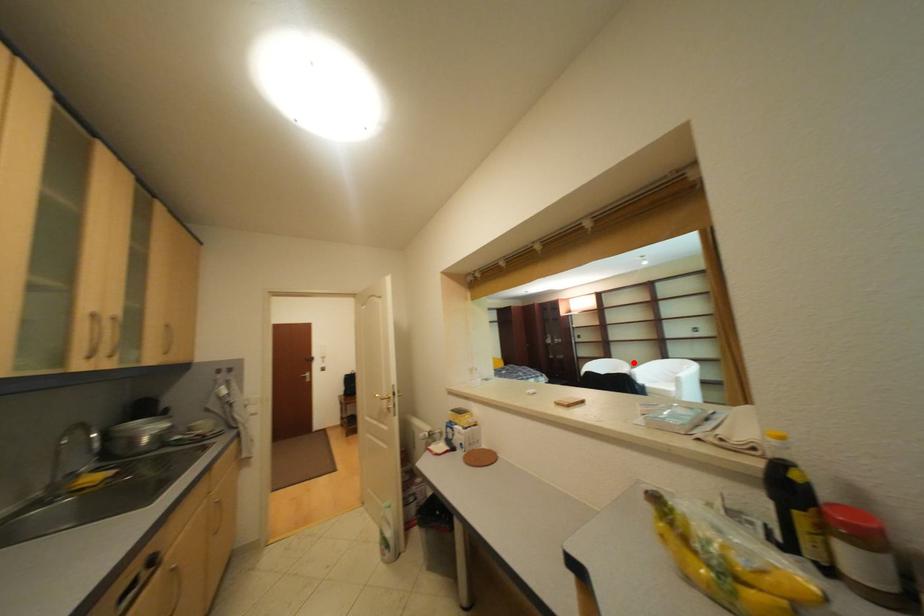
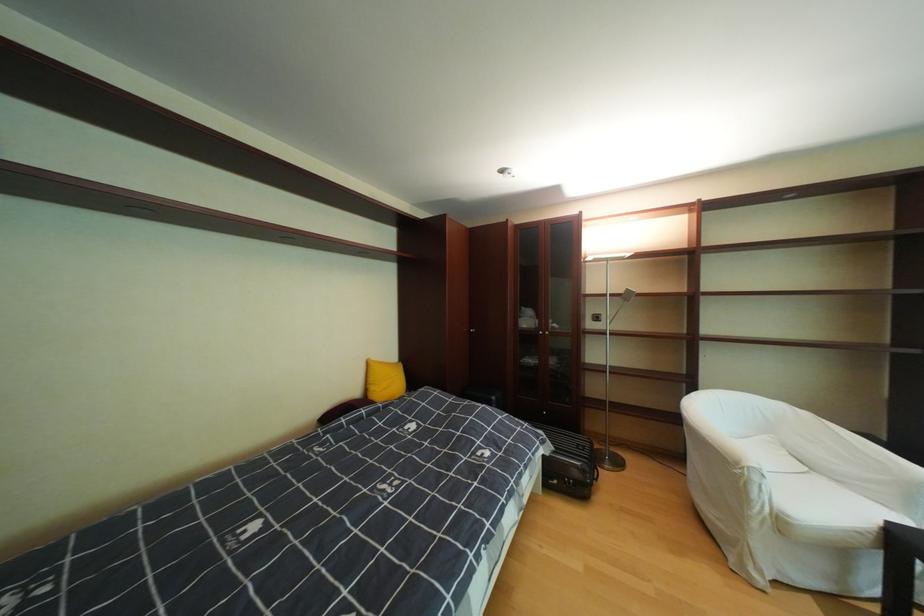
Where in the second image is the point corresponding to the highlighted location from the first image?

(793, 407)